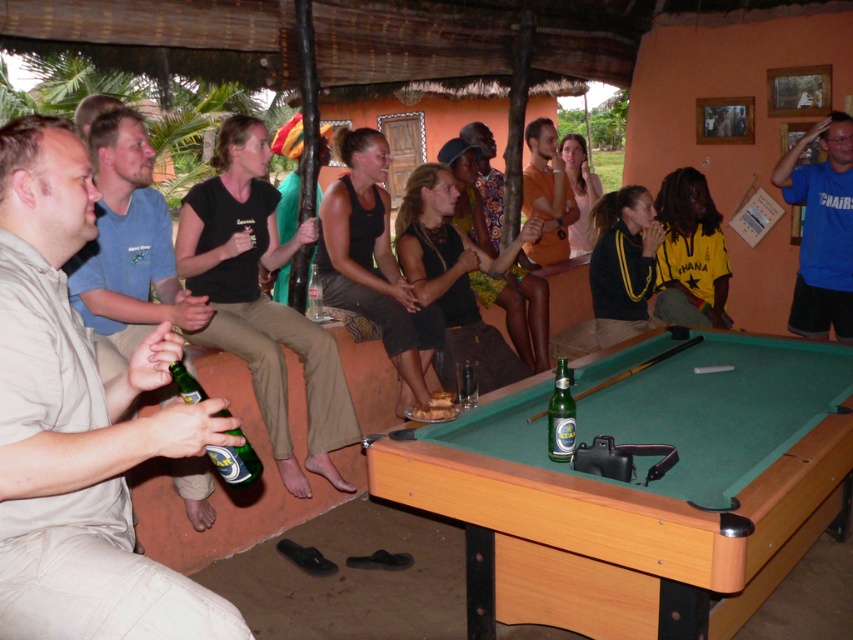
You are a bartender at the rustic open air bar. You need to retrieve the clear glass bottle at center to serve a drink. What must you move first from the green glass bottle at center?

The green glass bottle at center is positioned under the clear glass bottle at center, so you must move the green glass bottle at center first to access the clear glass bottle at center.

You are standing at the entrance of the bar and see the point at coordinates (79,424). What object is located at that point?

The point at coordinates (79,424) indicates the beige cotton shirt at left.